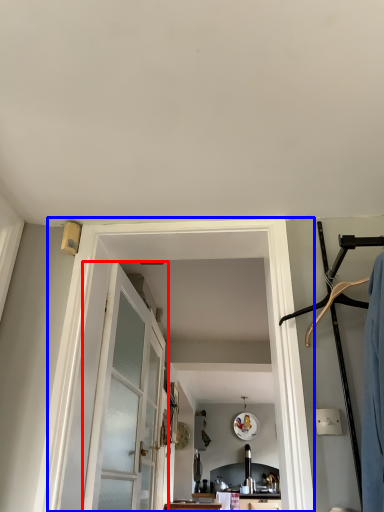
Question: Which object appears closest to the camera in this image, door (highlighted by a red box) or barn door (highlighted by a blue box)?

Choices:
 (A) door
 (B) barn door

Answer: (B)